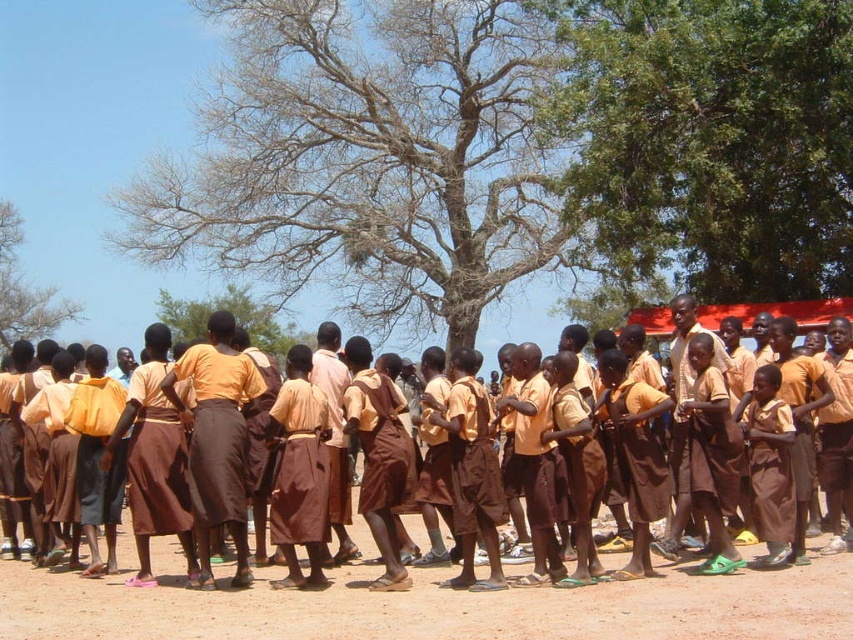
Question: Is brown fabric skirt at lower right bigger than brown fabric skirt at center?

Choices:
 (A) yes
 (B) no

Answer: (A)

Question: Which object is closer to the camera taking this photo?

Choices:
 (A) green leafy tree at upper right
 (B) brown dirt field at lower center

Answer: (B)

Question: Which point appears farthest from the camera in this image?

Choices:
 (A) (616, 38)
 (B) (161, 596)
 (C) (10, 307)
 (D) (228, 292)

Answer: (C)

Question: Which of the following is the closest to the observer?

Choices:
 (A) (103, 602)
 (B) (694, 209)

Answer: (A)

Question: In this image, where is brown dirt field at lower center located relative to brown fabric skirt at center?

Choices:
 (A) below
 (B) above

Answer: (A)

Question: Can you confirm if bare branches at upper left is positioned to the right of brown fabric skirt at center?

Choices:
 (A) yes
 (B) no

Answer: (B)